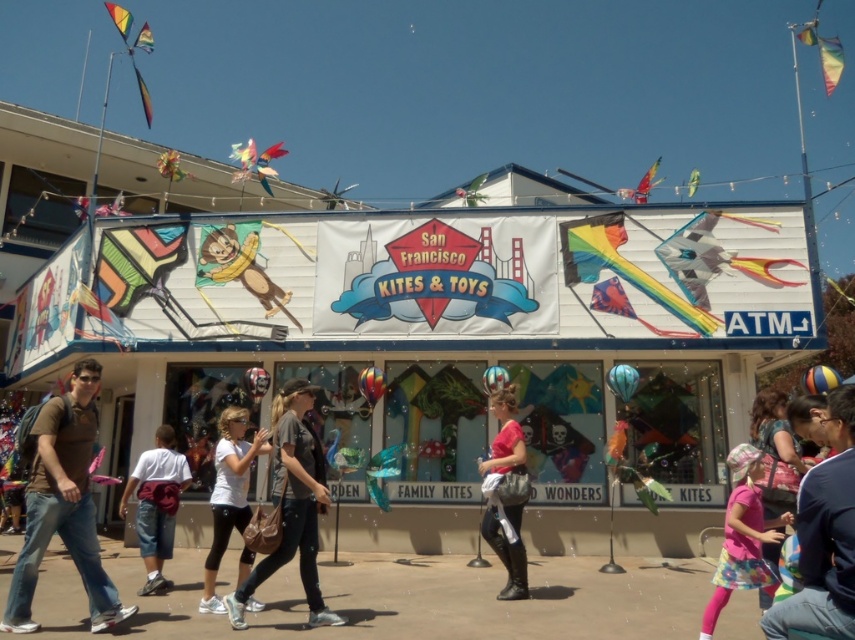
You are a customer standing in front of the shop and see both the white matte shirt at center and the white cotton shirt at left. Which shirt is closer to you?

The white matte shirt at center is closer to you because it is in front of the white cotton shirt at left.